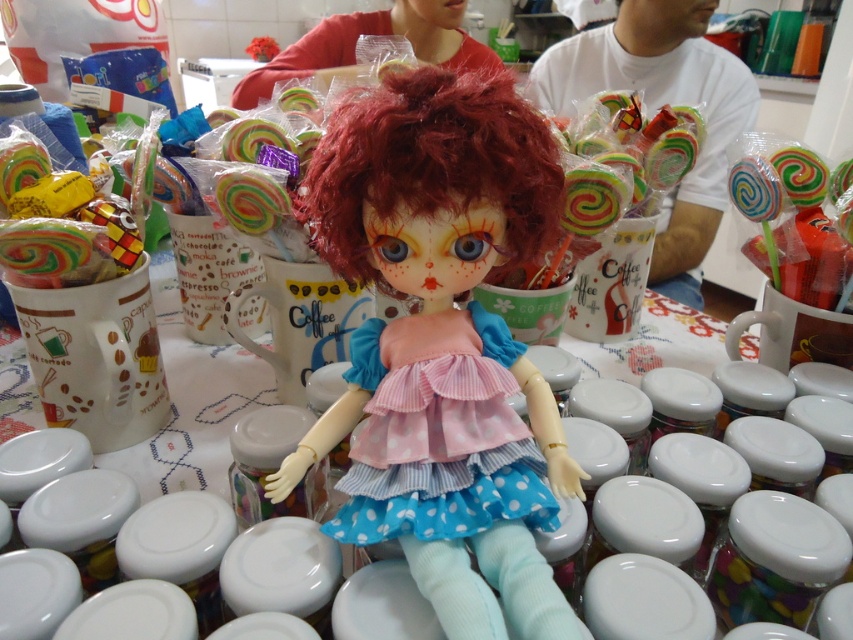
You are a child looking at the doll and its accessories on the table. You want to grab the multicolored spiral lollipop at center without touching the pink fabric dress at center. Is it possible?

The pink fabric dress at center is below the multicolored spiral lollipop at center, so yes, you can grab the multicolored spiral lollipop at center without touching the pink fabric dress at center since it is positioned above it.

You are a child who wants to choose the taller lollipop between the multicolored lollipop at center and the multicolored spiral lollipop at center. Which one should you pick?

The multicolored spiral lollipop at center is taller than the multicolored lollipop at center, so you should pick the multicolored spiral lollipop at center.

You are a delivery robot that needs to place a small package on the table. The package must be placed at the point with coordinates point (442, 346). However, there is a matte plastic doll at center on the table. Can you place the package there?

The point (442, 346) is on the matte plastic doll at center, so you cannot place the package there because the doll is occupying that location.